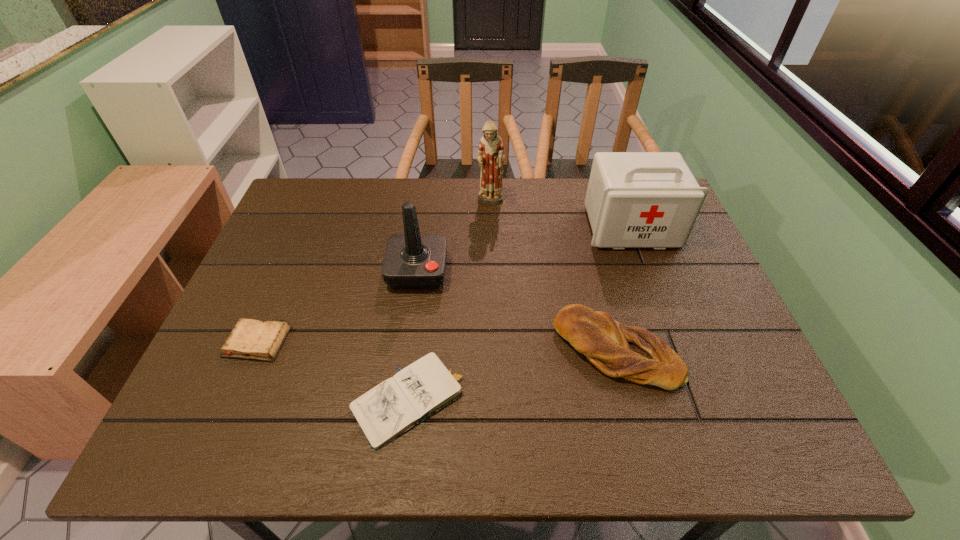
This screenshot has width=960, height=540. I want to click on free spot between the first-aid kit and the fourth object from left to right, so click(561, 215).

This screenshot has width=960, height=540. What are the coordinates of `free point between the fourth object from left to right and the leftmost object` in the screenshot? It's located at 373,272.

Locate an element on the screen. free point between the leftmost object and the notebook is located at coordinates (334, 371).

I want to click on object identified as the closest to the bread, so click(x=397, y=404).

Point out which object is positioned as the fifth nearest to the third farthest object. Please provide its 2D coordinates. Your answer should be formatted as a tuple, i.e. [(x, y)], where the tuple contains the x and y coordinates of a point satisfying the conditions above.

[(634, 199)]

Find the location of a particular element. The image size is (960, 540). free space that satisfies the following two spatial constraints: 1. on the front-facing side of the fourth object from left to right; 2. on the right side of the bread is located at coordinates (494, 350).